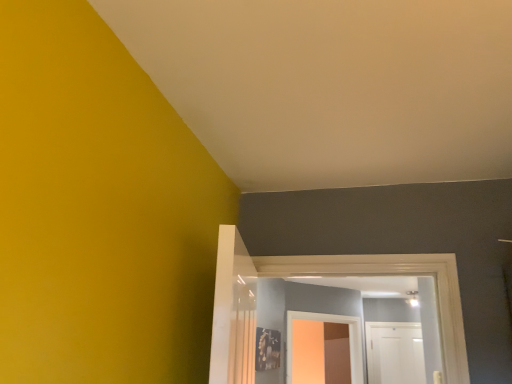
Where is `white matte door at center`? The width and height of the screenshot is (512, 384). white matte door at center is located at coordinates (395, 353).

What do you see at coordinates (395, 353) in the screenshot? The width and height of the screenshot is (512, 384). I see `white matte door at center` at bounding box center [395, 353].

Locate an element on the screen. This screenshot has width=512, height=384. white matte door at center is located at coordinates (395, 353).